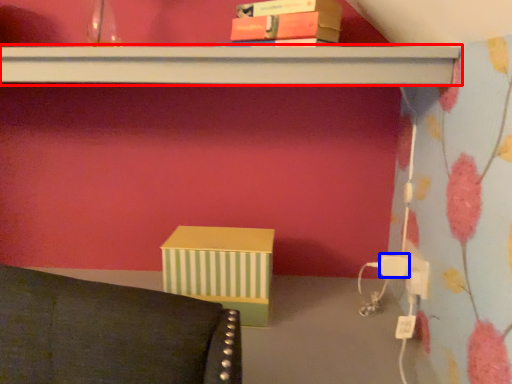
Question: Which of the following is the closest to the observer, shelf (highlighted by a red box) or plug (highlighted by a blue box)?

Choices:
 (A) shelf
 (B) plug

Answer: (A)